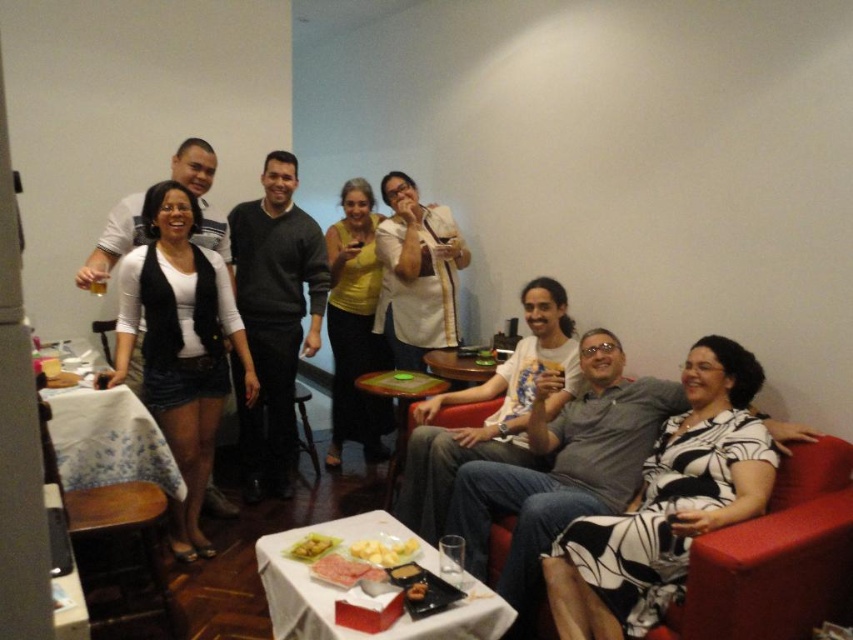
Question: Considering the real-world distances, which object is closest to the yellow matte food at center?

Choices:
 (A) yellow matte cheese at center
 (B) white t-shirt at center
 (C) smooth brown bread at center
 (D) yellow matte dress at center

Answer: (A)

Question: Which point is closer to the camera?

Choices:
 (A) (190, 278)
 (B) (424, 584)
 (C) (367, 547)

Answer: (B)

Question: Which object is positioned farthest from the matte black couch at center?

Choices:
 (A) yellow matte dress at center
 (B) black and white dress at center
 (C) dark gray sweater at center
 (D) yellow matte cheese at center

Answer: (C)

Question: Is red leather couch at lower right further to camera compared to white t-shirt at center?

Choices:
 (A) no
 (B) yes

Answer: (A)

Question: Can you confirm if matte black vest at left is positioned to the left of yellow matte cheese at center?

Choices:
 (A) no
 (B) yes

Answer: (B)

Question: From the image, what is the correct spatial relationship of black and white dress at center in relation to dark gray sweater at center?

Choices:
 (A) right
 (B) left

Answer: (A)